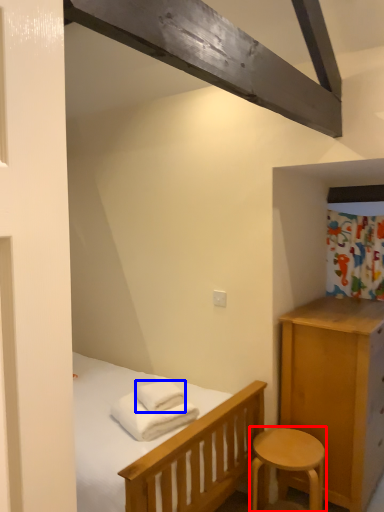
Question: Which object is closer to the camera taking this photo, stool (highlighted by a red box) or bath towel (highlighted by a blue box)?

Choices:
 (A) stool
 (B) bath towel

Answer: (A)